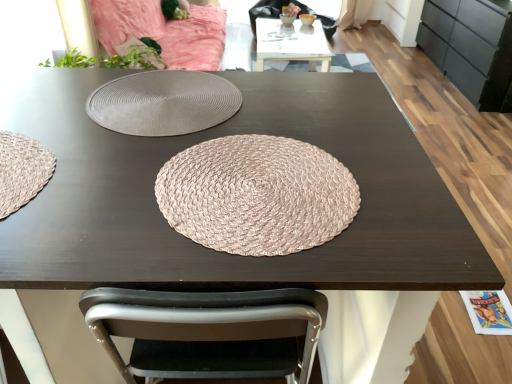
I want to click on free space to the left of matte gray placemat at center, so click(x=47, y=99).